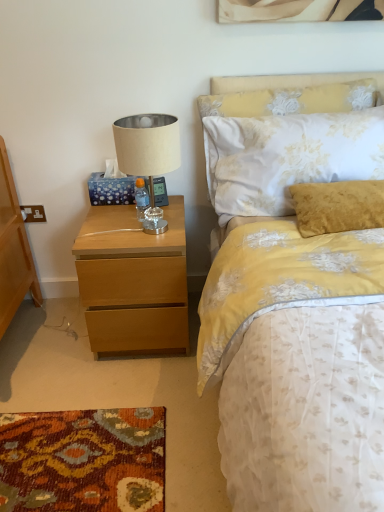
Question: Based on their sizes in the image, would you say light wood nightstand at left is bigger or smaller than floral fabric pillow at upper right?

Choices:
 (A) small
 (B) big

Answer: (B)

Question: From the image's perspective, is light wood nightstand at left located above or below floral fabric pillow at upper right?

Choices:
 (A) below
 (B) above

Answer: (A)

Question: Which of these objects is positioned closest to the floral fabric pillow at upper right?

Choices:
 (A) light wood nightstand at left
 (B) beige fabric lampshade at upper left

Answer: (B)

Question: Which is nearer to the beige fabric lampshade at upper left?

Choices:
 (A) floral fabric pillow at upper right
 (B) light wood nightstand at left

Answer: (B)